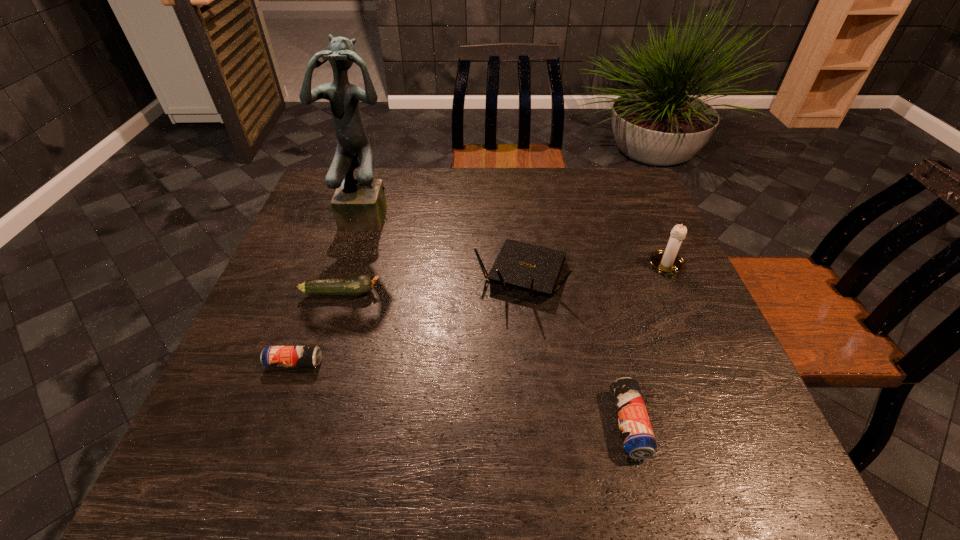
Locate an element on the screen. vacant region that satisfies the following two spatial constraints: 1. on the face of the sculpture; 2. on the right side of the right beer can is located at coordinates (307, 424).

I want to click on vacant area in the image that satisfies the following two spatial constraints: 1. on the face of the nearest object; 2. on the left side of the farthest object, so click(307, 424).

I want to click on vacant space that satisfies the following two spatial constraints: 1. at the blossom end of the zucchini; 2. on the right side of the fifth object from left to right, so click(x=300, y=424).